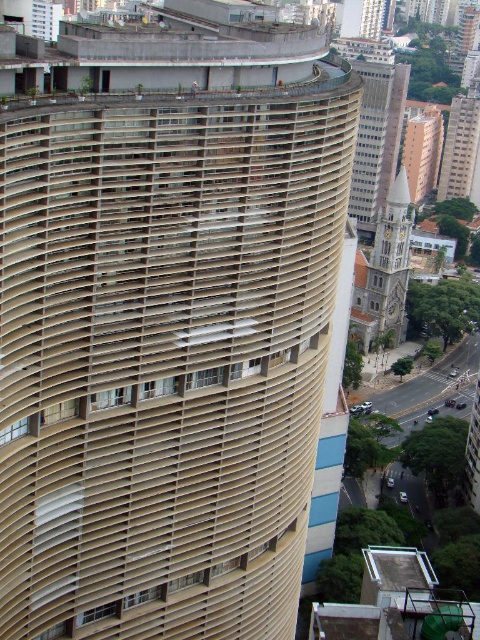
Between point (45, 134) and point (384, 244), which one is positioned in front?

Positioned in front is point (45, 134).

In the scene shown: Measure the distance between point (7, 369) and camera.

The distance of point (7, 369) from camera is 46.05 meters.

Where is `beige textured building at center`? beige textured building at center is located at coordinates (165, 323).

Is point (360, 108) closer to viewer compared to point (402, 188)?

Yes, point (360, 108) is in front of point (402, 188).

How distant is beige textured tower at upper right from white stone tower at right?

beige textured tower at upper right is 109.00 meters away from white stone tower at right.

Is point (374, 99) positioned before point (365, 340)?

No, (374, 99) is further to viewer.

At what (x,y) coordinates should I click in order to perform the action: click on beige textured tower at upper right. Please return your answer as a coordinate pair (x, y). The image size is (480, 640). Looking at the image, I should click on (374, 125).

Is white stone tower at right above beige textured building at upper right?

No, white stone tower at right is not above beige textured building at upper right.

Who is more forward, (x=386, y=336) or (x=437, y=116)?

Positioned in front is point (x=386, y=336).

This screenshot has width=480, height=640. What do you see at coordinates (384, 273) in the screenshot? I see `white stone tower at right` at bounding box center [384, 273].

Locate an element on the screen. white stone tower at right is located at coordinates (384, 273).